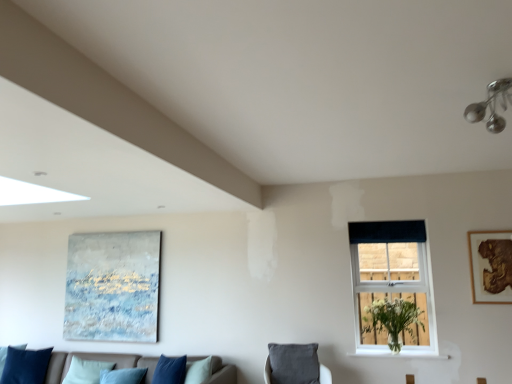
This screenshot has width=512, height=384. I want to click on textured canvas painting at left, the 1th picture frame viewed from the left, so click(x=113, y=286).

Find the location of a particular element. Image resolution: width=512 pixels, height=384 pixels. dark blue fabric at upper right is located at coordinates (387, 232).

What is the approximate height of wooden framed artwork at upper right, which appears as the 2th picture frame when viewed from the left?

26.42 inches.

Describe the element at coordinates (295, 365) in the screenshot. The height and width of the screenshot is (384, 512). I see `velvet grey cushion at lower center` at that location.

I want to click on white matte vase at window, so click(393, 320).

Where is `white plastic window at center`? This screenshot has width=512, height=384. white plastic window at center is located at coordinates (392, 288).

Is velvet blue pillow at lower left placed right next to white painted wood at lower right?

velvet blue pillow at lower left and white painted wood at lower right are clearly separated.

Would you say velvet blue pillow at lower left is to the left or to the right of white painted wood at lower right in the picture?

Clearly, velvet blue pillow at lower left is on the left of white painted wood at lower right in the image.

From the image's perspective, is velvet blue pillow at lower left under white painted wood at lower right?

Yes.

Does velvet blue pillow at lower left come in front of white painted wood at lower right?

No, the depth of velvet blue pillow at lower left is greater than that of white painted wood at lower right.

In the image, is white painted wood at lower right on the left side or the right side of velvet blue pillow at lower left?

white painted wood at lower right is to the right of velvet blue pillow at lower left.

Can you see white painted wood at lower right touching velvet blue pillow at lower left?

No.

Which point is more forward, [361,347] or [8,372]?

The point [361,347] is closer.

Who is bigger, white painted wood at lower right or velvet blue pillow at lower left?

velvet blue pillow at lower left.

From a real-world perspective, who is located higher, dark blue fabric at upper right or white matte vase at window?

In real-world perspective, dark blue fabric at upper right is above.

Considering the relative sizes of dark blue fabric at upper right and white matte vase at window in the image provided, is dark blue fabric at upper right shorter than white matte vase at window?

Correct, dark blue fabric at upper right is not as tall as white matte vase at window.

Is dark blue fabric at upper right positioned beyond the bounds of white matte vase at window?

Yes, dark blue fabric at upper right is not within white matte vase at window.

Based on the photo, is white matte vase at window oriented towards velvet grey cushion at lower center?

No, white matte vase at window is not facing towards velvet grey cushion at lower center.

Which is more distant, (417, 334) or (275, 360)?

The point (417, 334) is behind.

Between white matte vase at window and velvet grey cushion at lower center, which one has smaller size?

With smaller size is velvet grey cushion at lower center.

From a real-world perspective, is white matte vase at window under velvet grey cushion at lower center?

No.

Between point (398, 241) and point (24, 363), which one is positioned in front?

Point (398, 241)

Between dark blue fabric at upper right and velvet blue pillow at lower left, which one has smaller width?

Thinner between the two is dark blue fabric at upper right.

Which of these two, dark blue fabric at upper right or velvet blue pillow at lower left, is bigger?

velvet blue pillow at lower left is bigger.

Does dark blue fabric at upper right touch velvet blue pillow at lower left?

No, dark blue fabric at upper right is not next to velvet blue pillow at lower left.

Which of these two, velvet blue cushions at lower left or velvet grey cushion at lower center, is bigger?

Bigger between the two is velvet blue cushions at lower left.

Which is in front, velvet blue cushions at lower left or velvet grey cushion at lower center?

velvet blue cushions at lower left is closer to the camera.

Can you tell me how much velvet blue cushions at lower left and velvet grey cushion at lower center differ in facing direction?

The facing directions of velvet blue cushions at lower left and velvet grey cushion at lower center are 21.8 degrees apart.

Is velvet grey cushion at lower center in contact with wooden framed artwork at upper right, which appears as the 2th picture frame when viewed from the left?

No, velvet grey cushion at lower center is not beside wooden framed artwork at upper right, which appears as the 2th picture frame when viewed from the left.

From a real-world perspective, which object rests below the other?

velvet grey cushion at lower center.

From the image's perspective, is velvet grey cushion at lower center over wooden framed artwork at upper right, positioned as the second picture frame in back-to-front order?

No, from the image's perspective, velvet grey cushion at lower center is not on top of wooden framed artwork at upper right, positioned as the second picture frame in back-to-front order.

What are the coordinates of `window sill to the right of velvet blue pillow at lower left` in the screenshot? It's located at pos(398,353).

Where is `pillow below the white painted wood at lower right (from a real-world perspective)`? pillow below the white painted wood at lower right (from a real-world perspective) is located at coordinates (26, 366).

Estimate the real-world distances between objects in this image. Which object is further from white matte vase at window, velvet blue pillow at lower left or wooden framed artwork at upper right, positioned as the second picture frame in back-to-front order?

velvet blue pillow at lower left.

Which object lies further to the anchor point wooden framed artwork at upper right, which appears as the first picture frame when viewed from the right, velvet blue cushions at lower left or dark blue fabric at upper right?

velvet blue cushions at lower left.

Considering their positions, is white matte vase at window positioned closer to white painted wood at lower right than velvet grey cushion at lower center?

white matte vase at window.

Which object lies nearer to the anchor point dark blue fabric at upper right, white painted wood at lower right or white plastic window at center?

Based on the image, white plastic window at center appears to be nearer to dark blue fabric at upper right.

Estimate the real-world distances between objects in this image. Which object is closer to textured canvas painting at left, which is the first picture frame in back-to-front order, dark blue fabric at upper right or white painted wood at lower right?

dark blue fabric at upper right lies closer to textured canvas painting at left, which is the first picture frame in back-to-front order, than the other object.

In the scene shown: Considering their positions, is white plastic window at center positioned closer to wooden framed artwork at upper right, which appears as the first picture frame when viewed from the right, than velvet blue cushions at lower left?

white plastic window at center is positioned closer to the anchor wooden framed artwork at upper right, which appears as the first picture frame when viewed from the right.

Which object lies nearer to the anchor point white matte vase at window, textured canvas painting at left, which is the 2th picture frame in front-to-back order, or velvet blue cushions at lower left?

velvet blue cushions at lower left is positioned closer to the anchor white matte vase at window.

Looking at the image, which one is located further to white plastic window at center, wooden framed artwork at upper right, the 1th picture frame when ordered from front to back, or textured canvas painting at left, which is the second picture frame from right to left?

Based on the image, textured canvas painting at left, which is the second picture frame from right to left, appears to be further to white plastic window at center.

You are a GUI agent. You are given a task and a screenshot of the screen. Output one action in this format:
    pyautogui.click(x=<x>, y=<y>)
    Task: Click on the window between velvet grey cushion at lower center and wooden framed artwork at upper right, positioned as the second picture frame in back-to-front order
    This screenshot has width=512, height=384.
    Given the screenshot: What is the action you would take?
    pyautogui.click(x=392, y=288)

Where is `curtain between velvet blue pillow at lower left and white plastic window at center in the horizontal direction`? This screenshot has width=512, height=384. curtain between velvet blue pillow at lower left and white plastic window at center in the horizontal direction is located at coordinates (387, 232).

At what (x,y) coordinates should I click in order to perform the action: click on swivel chair between velvet blue pillow at lower left and white painted wood at lower right in the horizontal direction. Please return your answer as a coordinate pair (x, y). Looking at the image, I should click on (295, 365).

Where is `plant between velvet blue pillow at lower left and white plastic window at center from left to right`? plant between velvet blue pillow at lower left and white plastic window at center from left to right is located at coordinates (393, 320).